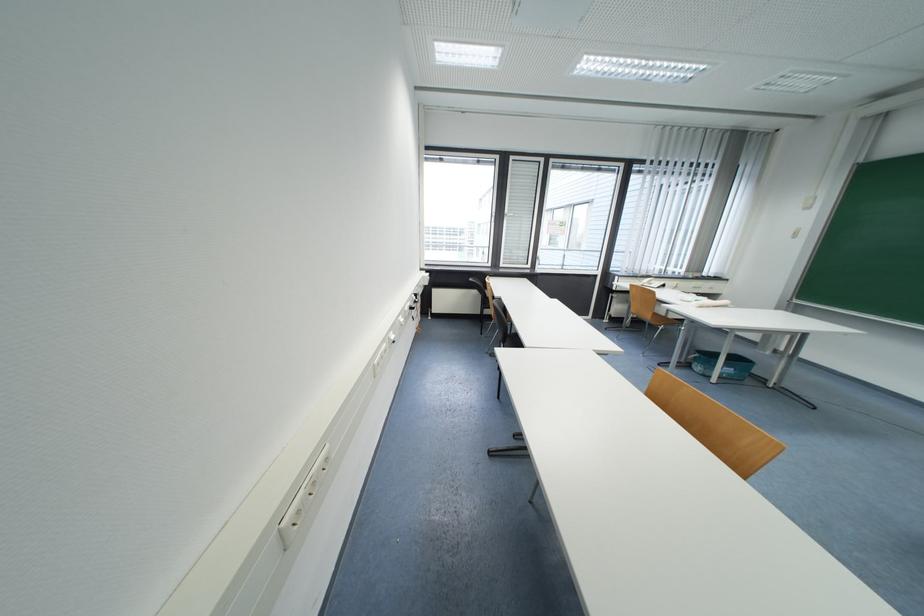
This screenshot has height=616, width=924. Identify the location of blue plastic bin. (721, 365).